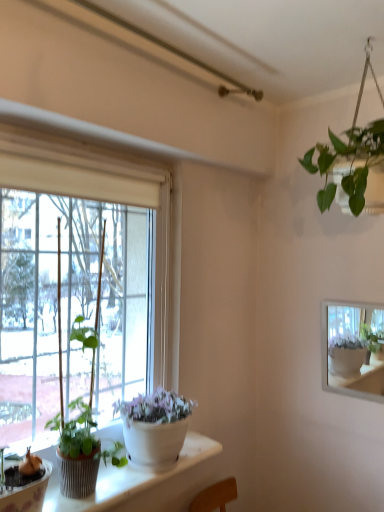
Question: Is green matte plant at left taller or shorter than transparent glass window at left?

Choices:
 (A) tall
 (B) short

Answer: (B)

Question: Is point (84, 335) closer or farther from the camera than point (79, 181)?

Choices:
 (A) farther
 (B) closer

Answer: (A)

Question: From a real-world perspective, relative to transparent glass window at left, is green matte plant at left vertically above or below?

Choices:
 (A) above
 (B) below

Answer: (B)

Question: Is transparent glass window at left taller or shorter than green matte plant at left?

Choices:
 (A) short
 (B) tall

Answer: (B)

Question: From the image's perspective, is transparent glass window at left above or below green matte plant at left?

Choices:
 (A) above
 (B) below

Answer: (A)

Question: Looking at their shapes, would you say transparent glass window at left is wider or thinner than green matte plant at left?

Choices:
 (A) wide
 (B) thin

Answer: (A)

Question: Considering the positions of point (162, 275) and point (77, 487), is point (162, 275) closer or farther from the camera than point (77, 487)?

Choices:
 (A) closer
 (B) farther

Answer: (B)